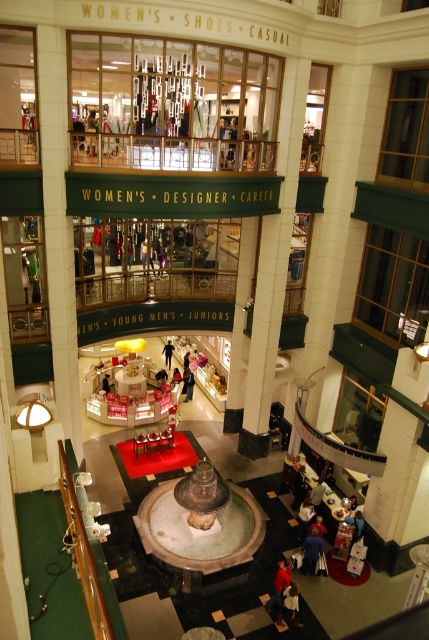
You are a store manager checking the layout of the mall. You notice the dark blue jeans at center and the white fabric person at center. Which object takes up more space in the central atrium?

The dark blue jeans at center has a larger size compared to the white fabric person at center, so the dark blue jeans at center takes up more space in the central atrium.

You are a delivery robot that is 3 feet wide. You are in the mall and need to move from the dark blue jeans at lower right to the white fabric person at center. Is there enough space for you to move directly between them?

The distance between the dark blue jeans at lower right and the white fabric person at center is 29.17 feet, so yes, the robot can move directly between them since the distance is more than enough for its width of 3 feet.

You are a store employee who needs to hang a large promotional banner in the central atrium. You see the matte black jacket at center and the white fabric person at center. Which object should you avoid placing the banner near to ensure it doesn not block the view of the smaller object?

You should avoid placing the banner near the matte black jacket at center because it is larger than the white fabric person at center, so placing the banner near the larger object might block the view of the smaller one.